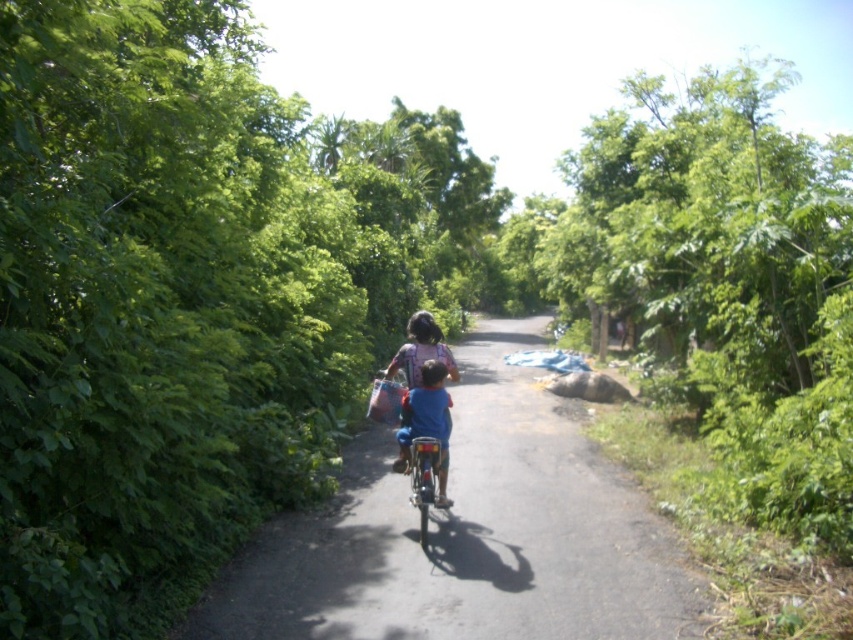
Can you confirm if blue matte shirt at center is positioned to the right of metallic blue bicycle at center?

Indeed, blue matte shirt at center is positioned on the right side of metallic blue bicycle at center.

This screenshot has height=640, width=853. I want to click on blue matte shirt at center, so coord(427,420).

Where is `blue matte shirt at center`? The image size is (853, 640). blue matte shirt at center is located at coordinates (427, 420).

Does smooth asphalt road at center have a larger size compared to metallic blue bicycle at center?

Correct, smooth asphalt road at center is larger in size than metallic blue bicycle at center.

Which is below, smooth asphalt road at center or metallic blue bicycle at center?

smooth asphalt road at center is below.

This screenshot has width=853, height=640. I want to click on smooth asphalt road at center, so click(x=469, y=534).

Can you confirm if smooth asphalt road at center is taller than blue matte shirt at center?

Incorrect, smooth asphalt road at center's height is not larger of blue matte shirt at center's.

Between point (355, 436) and point (448, 413), which one is positioned in front?

Point (448, 413)

At what (x,y) coordinates should I click in order to perform the action: click on smooth asphalt road at center. Please return your answer as a coordinate pair (x, y). Looking at the image, I should click on (469, 534).